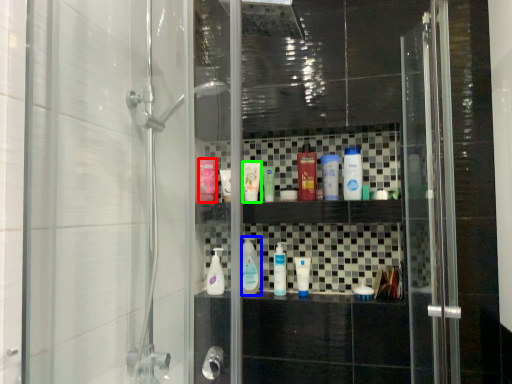
Question: Considering the real-world distances, which object is farthest from mouthwash (highlighted by a red box)? mouthwash (highlighted by a blue box) or toiletry (highlighted by a green box)?

Choices:
 (A) mouthwash
 (B) toiletry

Answer: (A)